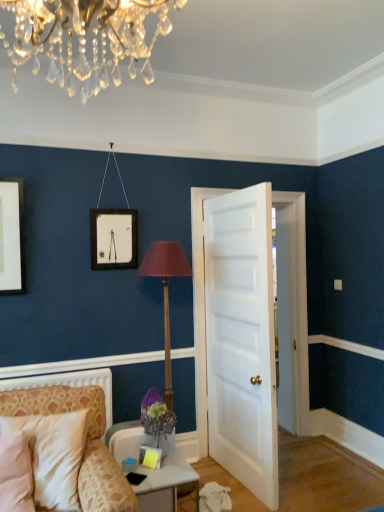
The width and height of the screenshot is (384, 512). What are the coordinates of `free space above white glossy table at lower center (from a real-world perspective)` in the screenshot? It's located at (150, 468).